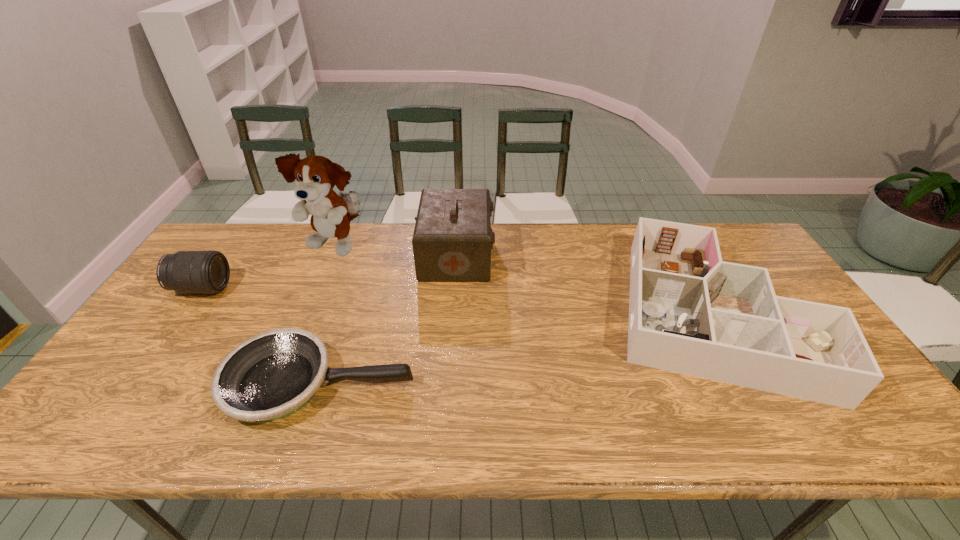
The height and width of the screenshot is (540, 960). Identify the location of puppy that is at the far edge. (316, 176).

Locate an element on the screen. The width and height of the screenshot is (960, 540). the first-aid kit located in the far edge section of the desktop is located at coordinates (452, 240).

Where is `dollhouse that is at the far edge`? dollhouse that is at the far edge is located at coordinates (691, 313).

Where is `dollhouse positioned at the near edge`? dollhouse positioned at the near edge is located at coordinates (691, 313).

Where is `frying pan located at the near edge`? Image resolution: width=960 pixels, height=540 pixels. frying pan located at the near edge is located at coordinates (269, 376).

Find the location of a particular element. object located at the left edge is located at coordinates (187, 272).

What are the coordinates of `object situated at the right edge` in the screenshot? It's located at pos(691,313).

Where is `object present at the far right corner`? Image resolution: width=960 pixels, height=540 pixels. object present at the far right corner is located at coordinates (691, 313).

This screenshot has width=960, height=540. Identify the location of object at the near right corner. click(691, 313).

The image size is (960, 540). In the image, there is a desktop. In order to click on vacant region at the far edge in this screenshot , I will do `click(278, 231)`.